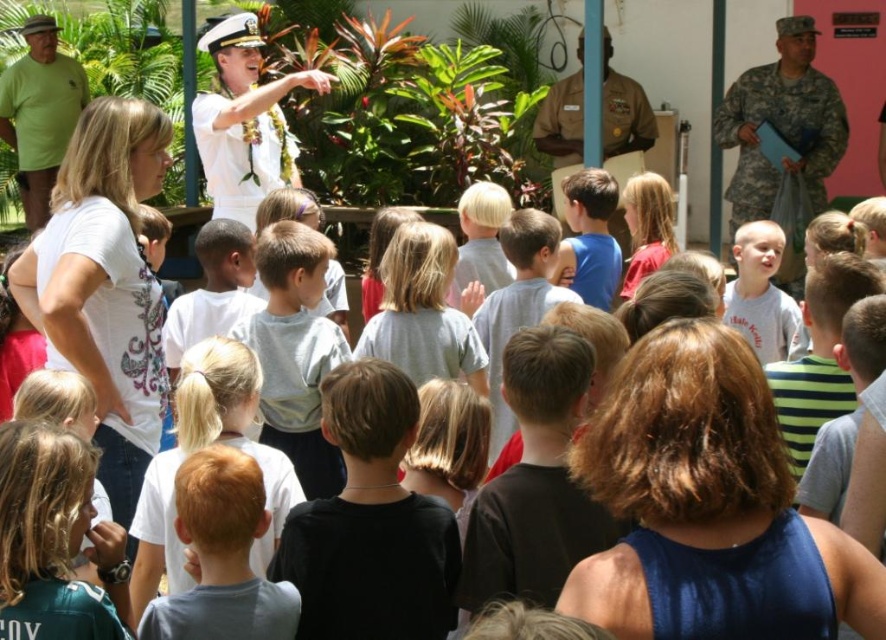
Looking at this image, you are a photographer at this event and want to capture a photo that includes both the black matte shirt at center and the camouflage uniform at upper right. Based on their positions, which one should you focus on first to ensure both are in frame?

→ The black matte shirt at center is below camouflage uniform at upper right, so you should focus on the camouflage uniform at upper right first to ensure both are in frame.